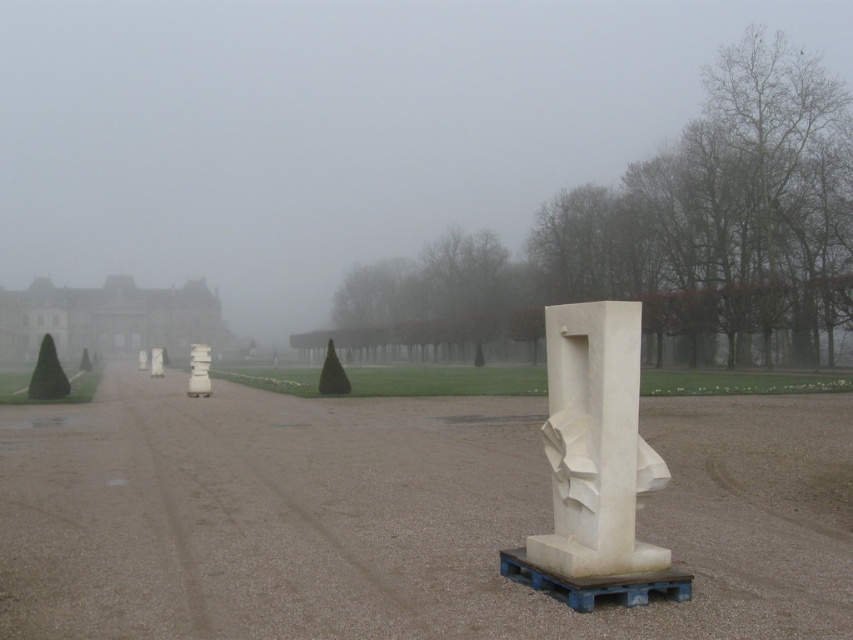
Question: Considering the real-world distances, which object is closest to the white stone palace at left?

Choices:
 (A) white marble sculpture at center
 (B) brown gravel dirt track at center

Answer: (B)

Question: Does white marble sculpture at center have a smaller size compared to white stone palace at left?

Choices:
 (A) yes
 (B) no

Answer: (A)

Question: Among these points, which one is farthest from the camera?

Choices:
 (A) (547, 589)
 (B) (529, 520)
 (C) (4, 353)

Answer: (C)

Question: Is white marble sculpture at center smaller than white stone palace at left?

Choices:
 (A) no
 (B) yes

Answer: (B)

Question: Which point is farther to the camera?

Choices:
 (A) (637, 323)
 (B) (113, 461)
 (C) (135, 294)

Answer: (C)

Question: Can you confirm if brown gravel dirt track at center is positioned below white stone palace at left?

Choices:
 (A) yes
 (B) no

Answer: (A)